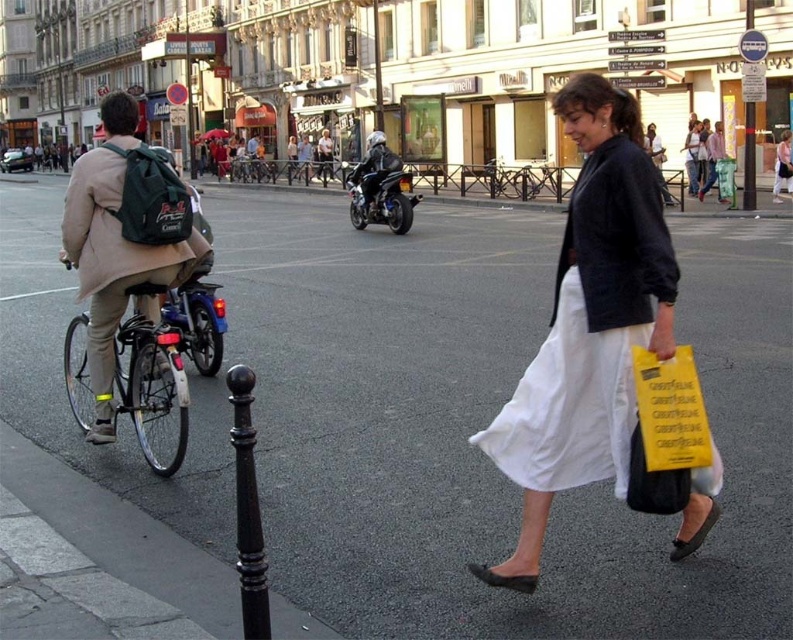
Question: Does black asphalt at center have a lesser width compared to matte green backpack at left?

Choices:
 (A) no
 (B) yes

Answer: (A)

Question: Which point is farther to the camera?

Choices:
 (A) matte black motorcycle at center
 (B) matte green backpack at left

Answer: (A)

Question: Is black asphalt at center below white cotton skirt at lower right?

Choices:
 (A) yes
 (B) no

Answer: (A)

Question: Which point is closer to the camera?

Choices:
 (A) (247, 522)
 (B) (171, 232)

Answer: (A)

Question: Which point is closer to the camera taking this photo?

Choices:
 (A) (753, 138)
 (B) (109, 260)

Answer: (B)

Question: Is black asphalt at center smaller than white cotton skirt at lower right?

Choices:
 (A) yes
 (B) no

Answer: (B)